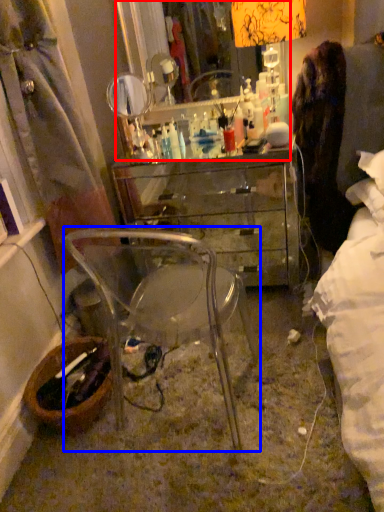
Question: Which of the following is the farthest to the observer, mirror (highlighted by a red box) or chair (highlighted by a blue box)?

Choices:
 (A) mirror
 (B) chair

Answer: (A)